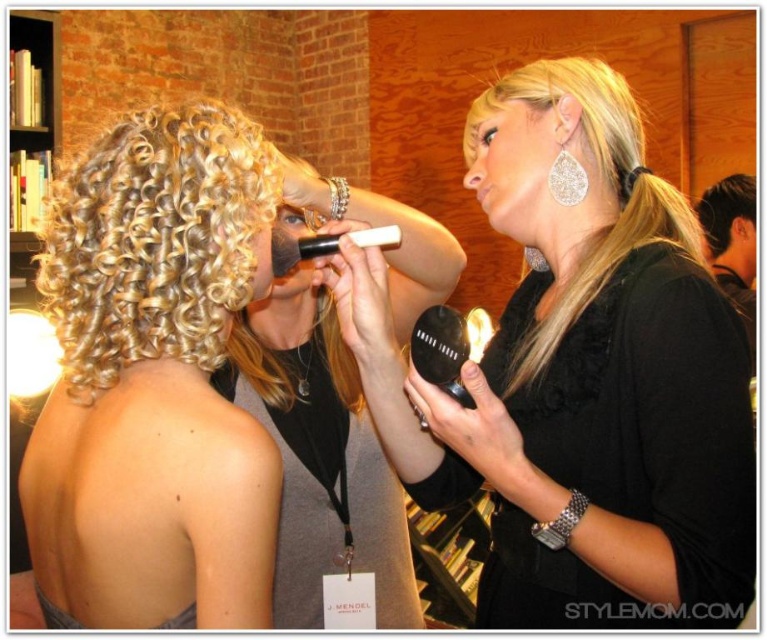
Which is behind, point (537, 202) or point (738, 248)?

Positioned behind is point (738, 248).

Does satin silver earrings at upper right have a larger size compared to satin black dress at upper right?

Incorrect, satin silver earrings at upper right is not larger than satin black dress at upper right.

Identify the location of satin silver earrings at upper right. (515, 168).

Identify the location of satin silver earrings at upper right. (515, 168).

Between point (146, 150) and point (732, 257), which one is positioned behind?

The point (732, 257) is behind.

This screenshot has width=767, height=640. I want to click on curly blonde hair at back, so click(x=155, y=241).

Between point (310, 225) and point (575, 182), which one is positioned in front?

Point (575, 182)

Between matte black makeup brush at center and clear crystal earring at upper right, which one appears on the right side from the viewer's perspective?

clear crystal earring at upper right is more to the right.

Who is more forward, (285,228) or (573,204)?

Point (573,204) is in front.

The image size is (767, 640). Identify the location of matte black makeup brush at center. tap(295, 220).